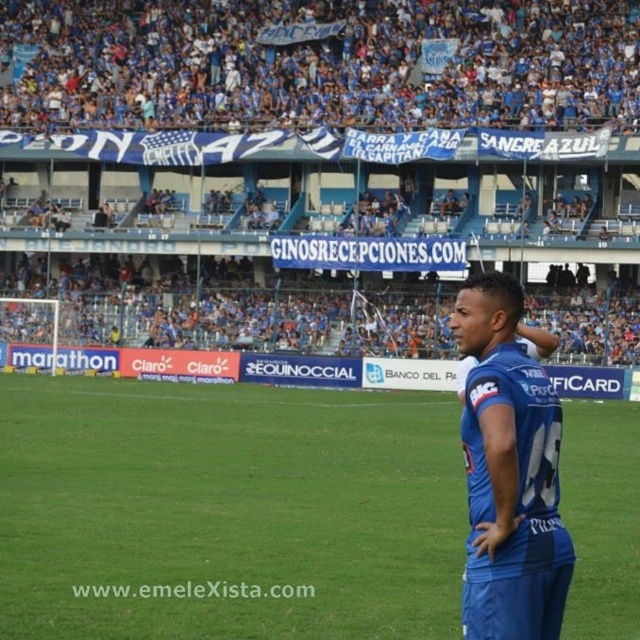
Is blue jersey at right taller than blue fabric uniform at right?

Correct, blue jersey at right is much taller as blue fabric uniform at right.

Is blue jersey at right positioned before blue fabric uniform at right?

No, blue jersey at right is further to the viewer.

Is point (234, 102) farther from camera compared to point (564, 566)?

Yes, it is behind point (564, 566).

At what (x,y) coordinates should I click in order to perform the action: click on blue jersey at right. Please return your answer as a coordinate pair (x, y). Looking at the image, I should click on (320, 65).

Measure the distance between blue fabric field at center and blue jersey at right.

blue fabric field at center is 87.63 feet from blue jersey at right.

Does blue fabric field at center have a greater height compared to blue jersey at right?

No.

Measure the distance between blue fabric field at center and camera.

blue fabric field at center and camera are 20.68 meters apart.

Image resolution: width=640 pixels, height=640 pixels. Find the location of `blue fabric field at center`. blue fabric field at center is located at coordinates (227, 512).

Who is lower down, blue fabric field at center or blue fabric uniform at right?

blue fabric field at center

Between point (61, 584) and point (518, 465), which one is positioned in front?

Point (518, 465)

This screenshot has width=640, height=640. I want to click on blue fabric field at center, so click(227, 512).